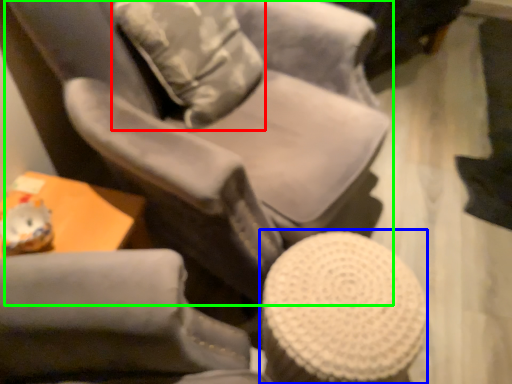
Question: Estimate the real-world distances between objects in this image. Which object is farther from throw pillow (highlighted by a red box), bar stool (highlighted by a blue box) or chair (highlighted by a green box)?

Choices:
 (A) bar stool
 (B) chair

Answer: (A)